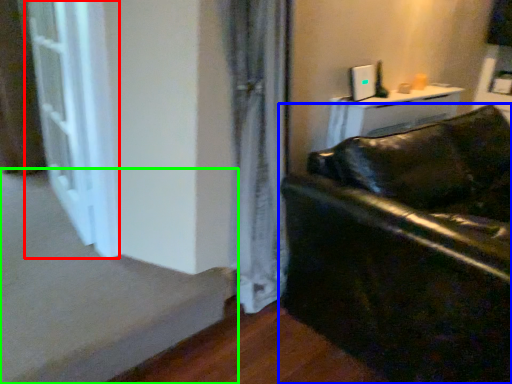
Question: Estimate the real-world distances between objects in this image. Which object is closer to screen door (highlighted by a red box), studio couch (highlighted by a blue box) or stairwell (highlighted by a green box)?

Choices:
 (A) studio couch
 (B) stairwell

Answer: (B)